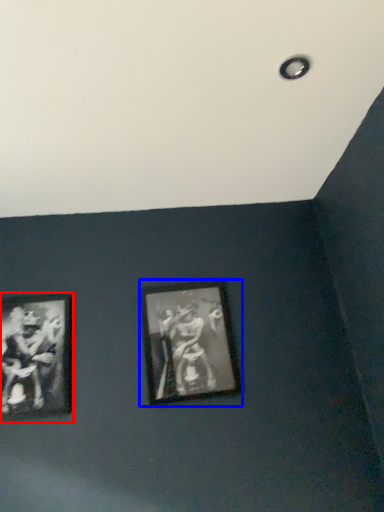
Question: Which point is further to the camera, picture frame (highlighted by a red box) or picture frame (highlighted by a blue box)?

Choices:
 (A) picture frame
 (B) picture frame

Answer: (B)